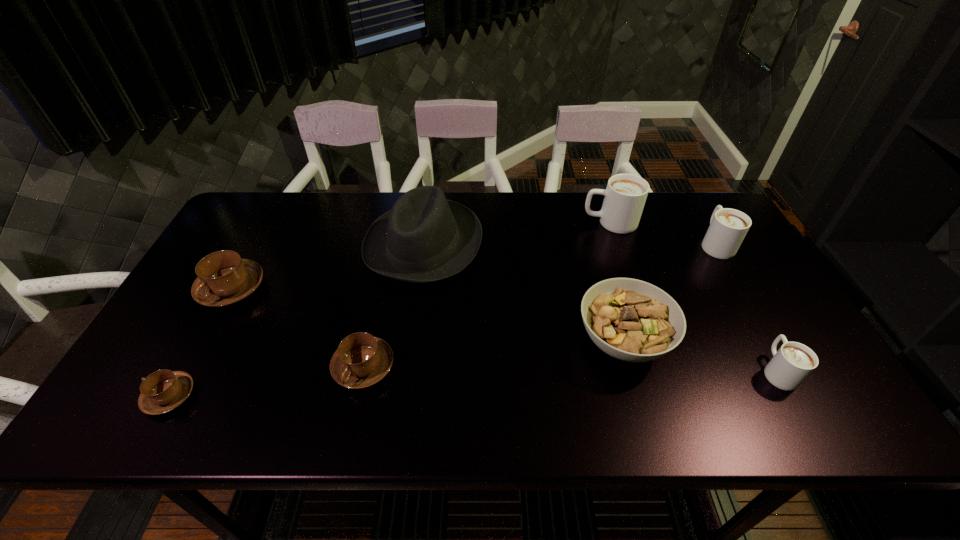
Identify the location of free space between the second biggest brown cappuccino and the gray fedora. (394, 305).

Find the location of a particular element. The height and width of the screenshot is (540, 960). unoccupied area between the shortest cappuccino and the nearest white cappuccino is located at coordinates (473, 383).

The height and width of the screenshot is (540, 960). In order to click on object that stands as the fifth closest to the gray fedora in this screenshot , I will do `click(162, 391)`.

Where is `object that is the fourth closest to the tallest cappuccino`? object that is the fourth closest to the tallest cappuccino is located at coordinates (793, 362).

Image resolution: width=960 pixels, height=540 pixels. I want to click on cappuccino that can be found as the third closest to the shortest object, so click(x=625, y=195).

Identify the location of cappuccino that is the second closest to the biggest white cappuccino. The height and width of the screenshot is (540, 960). (793, 362).

The image size is (960, 540). Find the location of `white cappuccino that stands as the third closest to the fourth cappuccino from right to left`. white cappuccino that stands as the third closest to the fourth cappuccino from right to left is located at coordinates (728, 227).

Identify which white cappuccino is the nearest to the leftmost white cappuccino. Please provide its 2D coordinates. Your answer should be formatted as a tuple, i.e. [(x, y)], where the tuple contains the x and y coordinates of a point satisfying the conditions above.

[(728, 227)]

The image size is (960, 540). Find the location of `the second closest brown cappuccino to the tallest cappuccino`. the second closest brown cappuccino to the tallest cappuccino is located at coordinates (224, 279).

Point out which brown cappuccino is positioned as the second nearest to the fourth cappuccino from right to left. Please provide its 2D coordinates. Your answer should be formatted as a tuple, i.e. [(x, y)], where the tuple contains the x and y coordinates of a point satisfying the conditions above.

[(162, 391)]